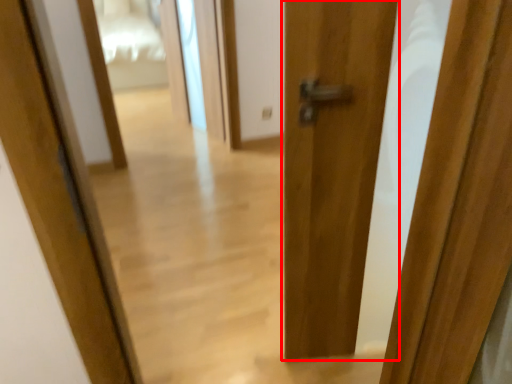
Question: Considering the relative positions of door (annotated by the red box) and screen door in the image provided, where is door (annotated by the red box) located with respect to the staircase?

Choices:
 (A) right
 (B) left

Answer: (A)